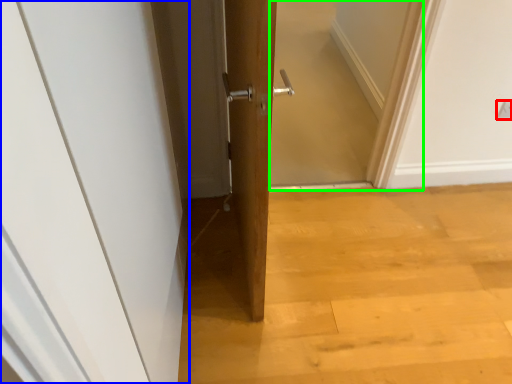
Question: Which object is the closest to the electric outlet (highlighted by a red box)? Choose among these: door (highlighted by a blue box) or screen door (highlighted by a green box).

Choices:
 (A) door
 (B) screen door

Answer: (B)